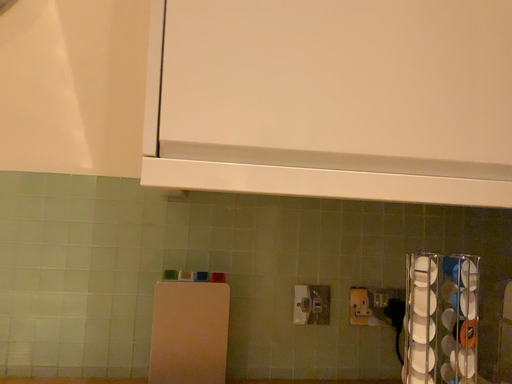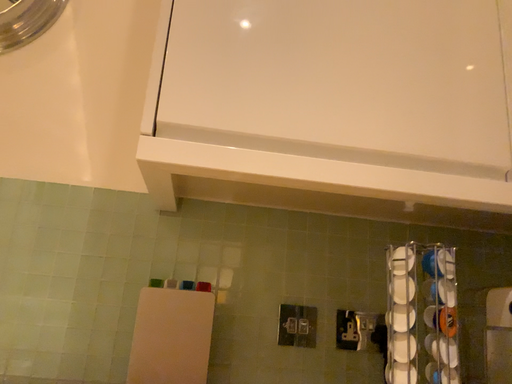
Question: How did the camera likely rotate when shooting the video?

Choices:
 (A) rotated downward
 (B) rotated upward

Answer: (B)